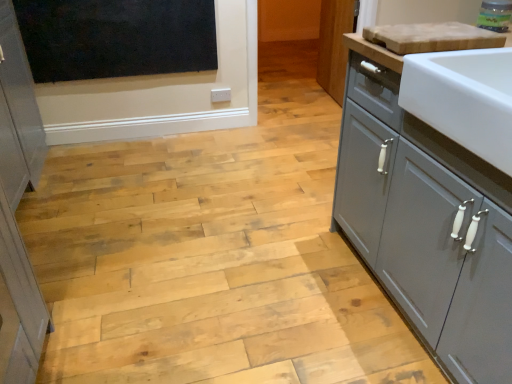
Question: In terms of size, does black matte window screen at upper left appear bigger or smaller than matte gray cabinet at right?

Choices:
 (A) big
 (B) small

Answer: (B)

Question: Is point (118, 26) positioned closer to the camera than point (342, 28)?

Choices:
 (A) closer
 (B) farther

Answer: (A)

Question: Estimate the real-world distances between objects in this image. Which object is closer to the light brown wood cutting board at upper right?

Choices:
 (A) matte gray cabinet at right
 (B) white glossy sink at right
 (C) black matte window screen at upper left
 (D) translucent glass jar at upper right

Answer: (D)

Question: Estimate the real-world distances between objects in this image. Which object is closer to the translucent glass jar at upper right?

Choices:
 (A) black matte window screen at upper left
 (B) white glossy sink at right
 (C) light brown wood cutting board at upper right
 (D) matte gray cabinet at right

Answer: (C)